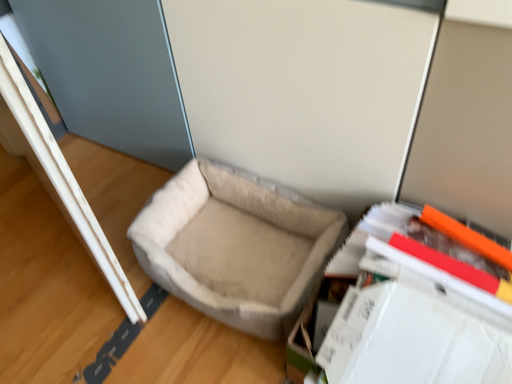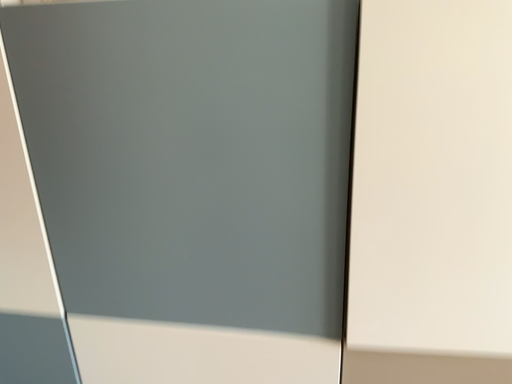
Question: How did the camera likely rotate when shooting the video?

Choices:
 (A) rotated right
 (B) rotated left

Answer: (A)